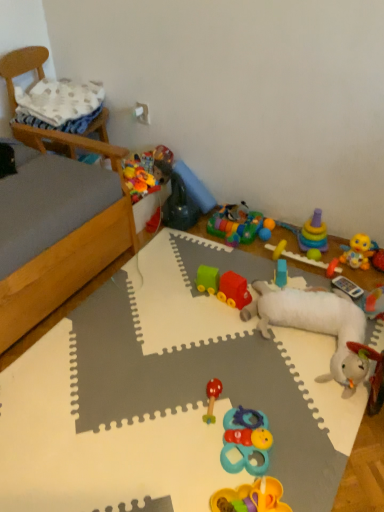
Question: Would you say blue plastic toy at center, which is counted as the sixth toy, starting from the top, is to the left or to the right of wooden chair at upper left in the picture?

Choices:
 (A) left
 (B) right

Answer: (B)

Question: From the image's perspective, is blue plastic toy at center, which appears as the fifth toy when ordered from the bottom, above or below wooden chair at upper left?

Choices:
 (A) below
 (B) above

Answer: (A)

Question: Which object is positioned closest to the wooden table at center?

Choices:
 (A) wooden bed frame at left
 (B) rubberized green toy at center, the tenth toy when ordered from bottom to top
 (C) multicolored plastic blocks at center, the second toy from the top
 (D) yellow rubber duck at right, the 3th toy from the top
 (E) rubberized red mushroom at center, which is counted as the ninth toy, starting from the top

Answer: (B)

Question: Based on their relative distances, which object is nearer to the wooden bed frame at left?

Choices:
 (A) blue plastic toy at center, which is counted as the sixth toy, starting from the top
 (B) multicolored plastic blocks at center, acting as the ninth toy starting from the bottom
 (C) multicolored plastic toy at upper right, the fifth toy when ordered from top to bottom
 (D) yellow rubber duck at right, which is the eighth toy from bottom to top
 (E) green rubber ball at upper right, the fourth toy from the top

Answer: (B)